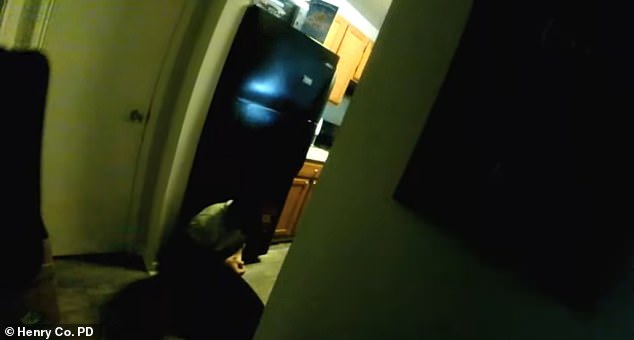
The image size is (634, 340). I want to click on white door, so click(92, 113).